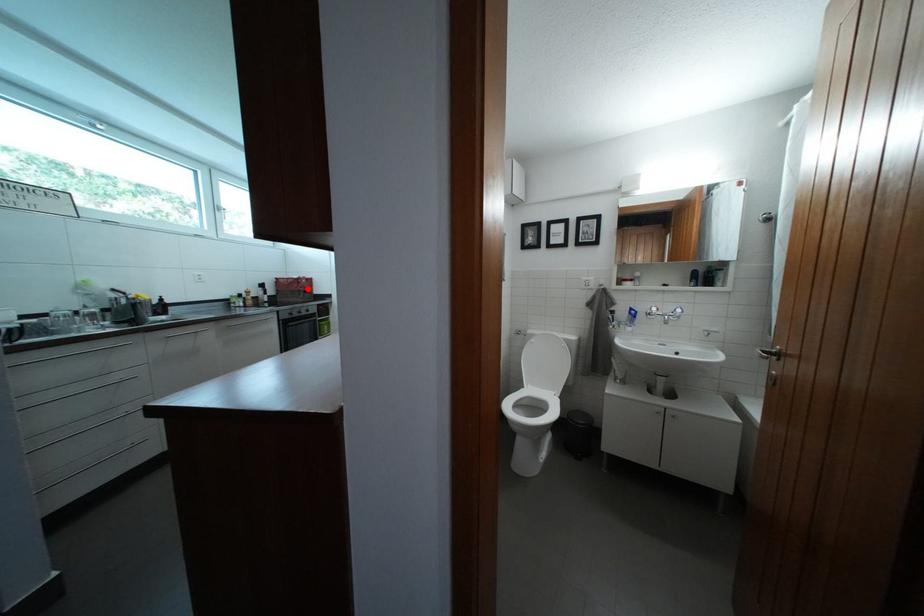
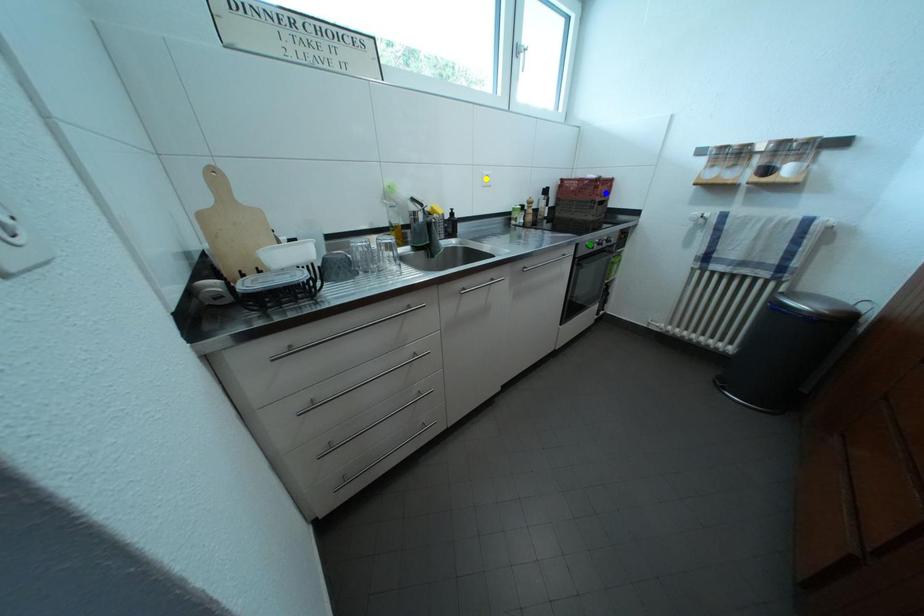
Question: I am providing you with two images of the same scene from different viewpoints. A red point is marked on the first image. You are given multiple points on the second image. Which mark in image 2 goes with the point in image 1?

Choices:
 (A) green point
 (B) blue point
 (C) yellow point

Answer: (B)